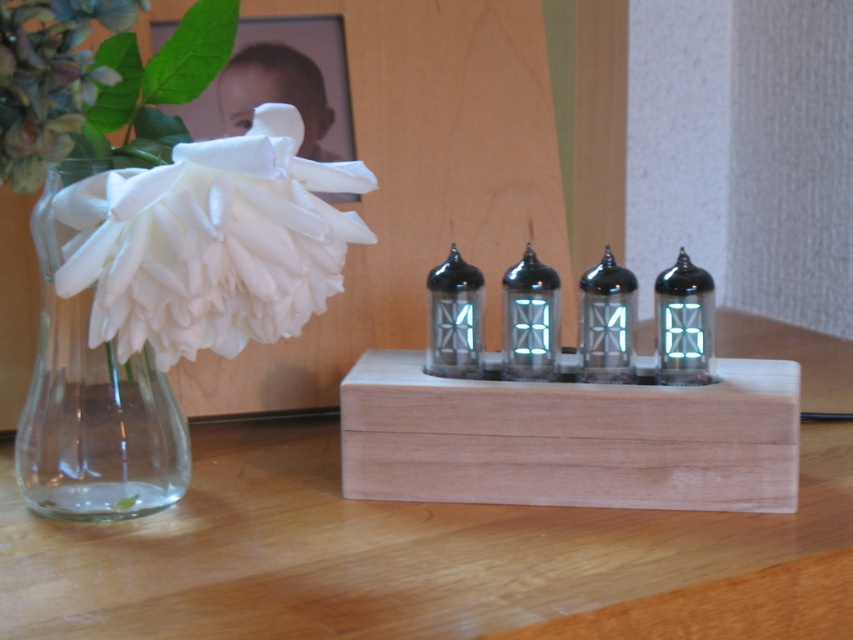
Looking at this image, you are arranging flowers in the transparent glass vase at left and want to place it near the wooden frame at upper left. Based on the scene, where should you position the vase relative to the frame?

The transparent glass vase at left should be placed below the wooden frame at upper left as it is already positioned there in the scene.

You are a photographer setting up a shot of the natural wood table at center and the wooden frame at upper left. Which object should you focus on first if you want to capture both in a single frame without adjusting your camera angle? Please explain your reasoning based on their positions and sizes.

The natural wood table at center is taller than the wooden frame at upper left, so you should focus on the natural wood table at center first as it is larger and more prominent in the scene.

You are arranging flowers in the transparent glass vase at left. You want to place it next to the wooden frame at upper left. Will the vase fit horizontally between the frame and the edge of the table?

The transparent glass vase at left is thinner than the wooden frame at upper left, so it will fit horizontally between the frame and the edge of the table since its width is narrower than the frame.